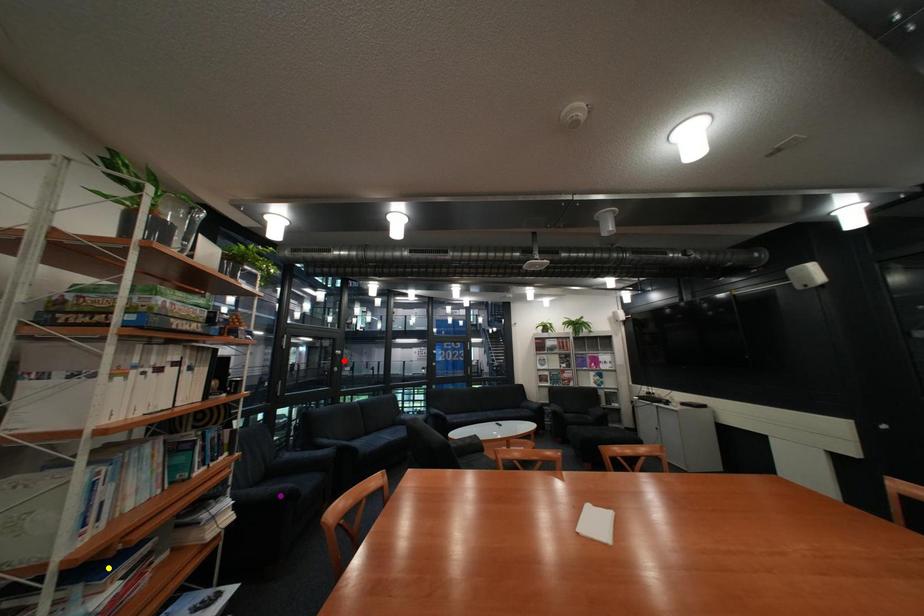
Order these from nearest to farthest:
1. purple point
2. yellow point
3. red point

1. yellow point
2. purple point
3. red point